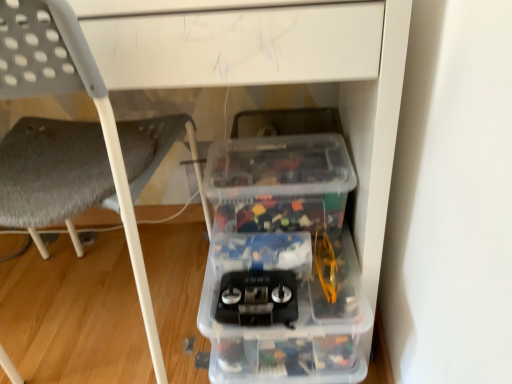
In order to face gray fabric chair at lower left, should I rotate leftwards or rightwards?

A 23.792 degree turn to the left will do.

What is the approximate width of gray fabric chair at lower left?

19.51 inches.

What do you see at coordinates (104, 140) in the screenshot? I see `gray fabric chair at lower left` at bounding box center [104, 140].

Locate an element on the screen. gray fabric chair at lower left is located at coordinates (104, 140).

Measure the distance between point (16, 3) and camera.

Point (16, 3) is 20.94 inches from camera.

The image size is (512, 384). In order to click on transparent plastic storage box at lower right in this screenshot , I will do `click(283, 254)`.

This screenshot has width=512, height=384. What do you see at coordinates (283, 254) in the screenshot?
I see `transparent plastic storage box at lower right` at bounding box center [283, 254].

Locate an element on the screen. gray fabric chair at lower left is located at coordinates point(104,140).

Considering the positions of objects gray fabric chair at lower left and transparent plastic storage box at lower right in the image provided, who is more to the right, gray fabric chair at lower left or transparent plastic storage box at lower right?

transparent plastic storage box at lower right.

From the picture: Who is more distant, gray fabric chair at lower left or transparent plastic storage box at lower right?

transparent plastic storage box at lower right is further from the camera.

Which is in front, point (148, 291) or point (230, 187)?

Positioned in front is point (230, 187).

From the image's perspective, does gray fabric chair at lower left appear lower than transparent plastic storage box at lower right?

Incorrect, from the image's perspective, gray fabric chair at lower left is higher than transparent plastic storage box at lower right.

From a real-world perspective, between gray fabric chair at lower left and transparent plastic storage box at lower right, who is vertically lower?

transparent plastic storage box at lower right, from a real-world perspective.

Considering the sizes of objects gray fabric chair at lower left and transparent plastic storage box at lower right in the image provided, who is thinner, gray fabric chair at lower left or transparent plastic storage box at lower right?

transparent plastic storage box at lower right is thinner.

Who is taller, gray fabric chair at lower left or transparent plastic storage box at lower right?

Standing taller between the two is gray fabric chair at lower left.

Can you confirm if gray fabric chair at lower left is smaller than transparent plastic storage box at lower right?

Incorrect, gray fabric chair at lower left is not smaller in size than transparent plastic storage box at lower right.

Is gray fabric chair at lower left not inside transparent plastic storage box at lower right?

gray fabric chair at lower left lies outside transparent plastic storage box at lower right's area.

Is the surface of gray fabric chair at lower left in direct contact with transparent plastic storage box at lower right?

gray fabric chair at lower left is not next to transparent plastic storage box at lower right, and they're not touching.

Is gray fabric chair at lower left facing towards transparent plastic storage box at lower right?

No.

What's the angular difference between gray fabric chair at lower left and transparent plastic storage box at lower right's facing directions?

The facing directions of gray fabric chair at lower left and transparent plastic storage box at lower right are 178 degrees apart.

How much distance is there between gray fabric chair at lower left and transparent plastic storage box at lower right?

gray fabric chair at lower left is 10.02 inches from transparent plastic storage box at lower right.

In the image, there is a gray fabric chair at lower left. Where is `storage box below it (from the image's perspective)`? The image size is (512, 384). storage box below it (from the image's perspective) is located at coordinates (283, 254).

Considering the relative positions of transparent plastic storage box at lower right and gray fabric chair at lower left in the image provided, is transparent plastic storage box at lower right to the left of gray fabric chair at lower left from the viewer's perspective?

No, transparent plastic storage box at lower right is not to the left of gray fabric chair at lower left.

Is transparent plastic storage box at lower right positioned in front of gray fabric chair at lower left?

→ No, transparent plastic storage box at lower right is further to the viewer.

Is point (285, 289) closer or farther from the camera than point (48, 3)?

Point (285, 289).

From the image's perspective, is transparent plastic storage box at lower right on top of gray fabric chair at lower left?

Actually, transparent plastic storage box at lower right appears below gray fabric chair at lower left in the image.

From a real-world perspective, which is physically above, transparent plastic storage box at lower right or gray fabric chair at lower left?

In real-world perspective, gray fabric chair at lower left is above.

Is transparent plastic storage box at lower right thinner than gray fabric chair at lower left?

Correct, the width of transparent plastic storage box at lower right is less than that of gray fabric chair at lower left.

Is transparent plastic storage box at lower right taller than gray fabric chair at lower left?

Incorrect, the height of transparent plastic storage box at lower right is not larger of that of gray fabric chair at lower left.

Between transparent plastic storage box at lower right and gray fabric chair at lower left, which one has larger size?

Bigger between the two is gray fabric chair at lower left.

Is transparent plastic storage box at lower right completely or partially outside of gray fabric chair at lower left?

Indeed, transparent plastic storage box at lower right is completely outside gray fabric chair at lower left.

Is the surface of transparent plastic storage box at lower right in direct contact with gray fabric chair at lower left?

transparent plastic storage box at lower right and gray fabric chair at lower left are clearly separated.

Consider the image. Is transparent plastic storage box at lower right facing away from gray fabric chair at lower left?

No, transparent plastic storage box at lower right's orientation is not away from gray fabric chair at lower left.

Locate an element on the screen. The width and height of the screenshot is (512, 384). chair lying in front of the transparent plastic storage box at lower right is located at coordinates (104, 140).

This screenshot has height=384, width=512. I want to click on chair located on the left of transparent plastic storage box at lower right, so click(x=104, y=140).

Where is `storage box below the gray fabric chair at lower left (from a real-world perspective)`? The image size is (512, 384). storage box below the gray fabric chair at lower left (from a real-world perspective) is located at coordinates (283, 254).